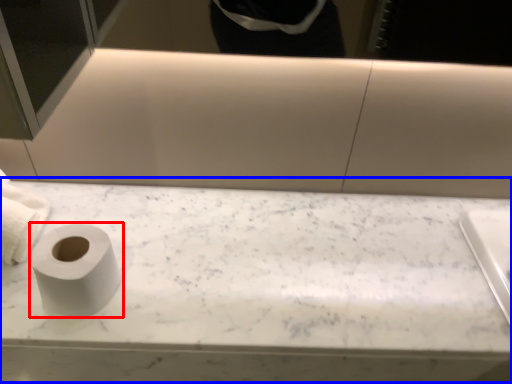
Question: Which of the following is the farthest to the observer, toilet paper (highlighted by a red box) or counter top (highlighted by a blue box)?

Choices:
 (A) toilet paper
 (B) counter top

Answer: (B)